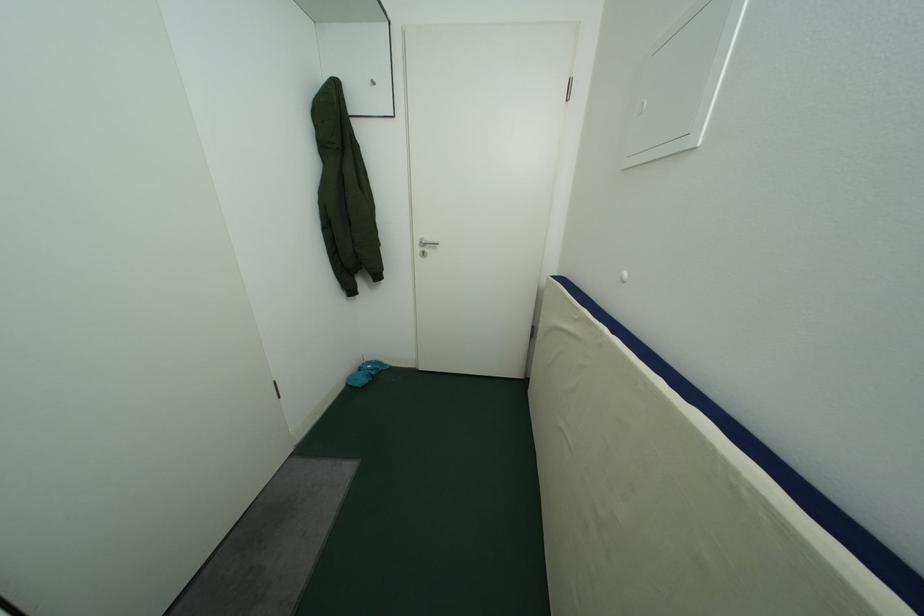
What do you see at coordinates (641, 107) in the screenshot? This screenshot has width=924, height=616. I see `the white panel handle` at bounding box center [641, 107].